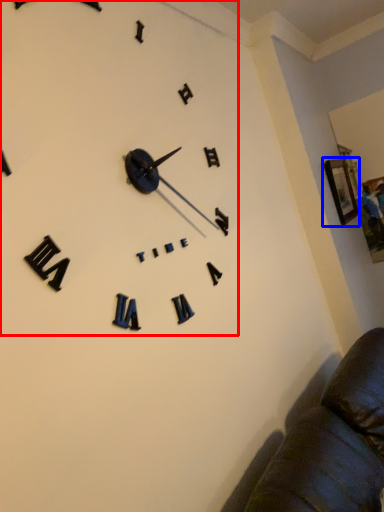
Question: Which object is closer to the camera taking this photo, clock (highlighted by a red box) or picture frame (highlighted by a blue box)?

Choices:
 (A) clock
 (B) picture frame

Answer: (A)